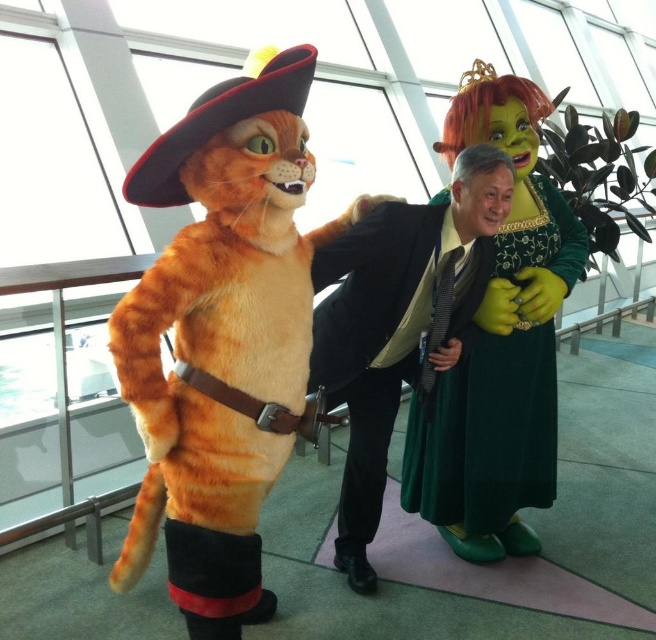
Question: Which object is positioned farthest from the green velvet dress at center?

Choices:
 (A) black suit at center
 (B) fluffy orange cat at left

Answer: (B)

Question: From the image, what is the correct spatial relationship of green velvet dress at center in relation to black suit at center?

Choices:
 (A) below
 (B) above

Answer: (B)

Question: From the image, what is the correct spatial relationship of fluffy orange cat at left in relation to green velvet dress at center?

Choices:
 (A) left
 (B) right

Answer: (A)

Question: Which point is farther to the camera?

Choices:
 (A) fluffy orange cat at left
 (B) black suit at center
 (C) green velvet dress at center

Answer: (C)

Question: Which is nearer to the black suit at center?

Choices:
 (A) green velvet dress at center
 (B) fluffy orange cat at left

Answer: (A)

Question: Is fluffy orange cat at left further to the viewer compared to black suit at center?

Choices:
 (A) yes
 (B) no

Answer: (B)